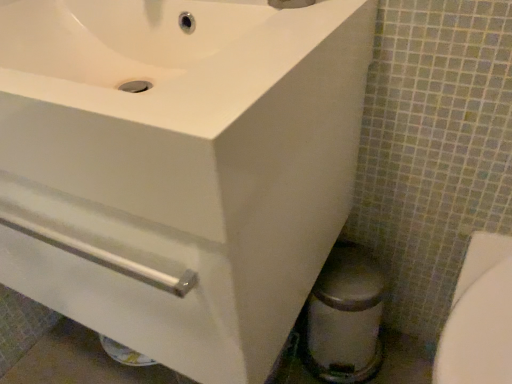
This screenshot has height=384, width=512. What are the coordinates of `vacant space in front of brushed metal faucet at upper center` in the screenshot? It's located at (290, 31).